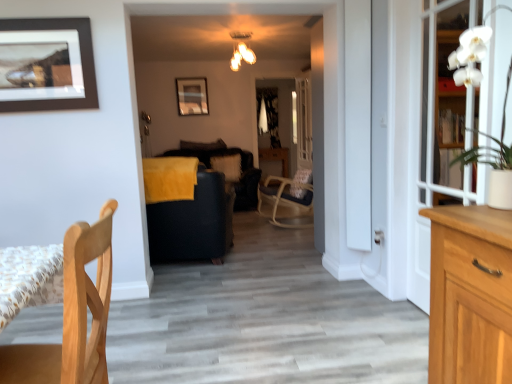
Question: Considering the relative sizes of matte black picture frame at upper center, the second picture frame ordered from the bottom, and clear glass door at center, the 1th glass door viewed from the left, in the image provided, is matte black picture frame at upper center, the second picture frame ordered from the bottom, taller than clear glass door at center, the 1th glass door viewed from the left,?

Choices:
 (A) yes
 (B) no

Answer: (B)

Question: Is matte black picture frame at upper center, arranged as the 2th picture frame when viewed from the front, oriented towards clear glass door at center, positioned as the first glass door in back-to-front order?

Choices:
 (A) yes
 (B) no

Answer: (B)

Question: Is matte black picture frame at upper center, the 1th picture frame positioned from the top, outside of clear glass door at center, positioned as the 2th glass door in front-to-back order?

Choices:
 (A) no
 (B) yes

Answer: (B)

Question: Are matte black picture frame at upper center, arranged as the 2th picture frame when viewed from the front, and clear glass door at center, which is the 2th glass door in right-to-left order, far apart?

Choices:
 (A) no
 (B) yes

Answer: (B)

Question: From the image's perspective, would you say matte black picture frame at upper center, arranged as the 2th picture frame when viewed from the front, is shown under clear glass door at center, which is the 2th glass door in right-to-left order?

Choices:
 (A) yes
 (B) no

Answer: (B)

Question: Does matte black picture frame at upper center, the second picture frame ordered from the bottom, come behind clear glass door at center, which is the 2th glass door in right-to-left order?

Choices:
 (A) yes
 (B) no

Answer: (A)

Question: Is metallic glass chandelier at upper center positioned in front of clear glass door at center, the 1th glass door viewed from the left?

Choices:
 (A) yes
 (B) no

Answer: (A)

Question: Is metallic glass chandelier at upper center wider than clear glass door at center, the 1th glass door viewed from the left?

Choices:
 (A) yes
 (B) no

Answer: (A)

Question: From a real-world perspective, does metallic glass chandelier at upper center sit lower than clear glass door at center, positioned as the 2th glass door in front-to-back order?

Choices:
 (A) no
 (B) yes

Answer: (A)

Question: Is metallic glass chandelier at upper center surrounding clear glass door at center, positioned as the first glass door in back-to-front order?

Choices:
 (A) yes
 (B) no

Answer: (B)

Question: Could you tell me if metallic glass chandelier at upper center is facing clear glass door at center, which is the 2th glass door in right-to-left order?

Choices:
 (A) no
 (B) yes

Answer: (A)

Question: Considering the relative positions of metallic glass chandelier at upper center and clear glass door at center, positioned as the 2th glass door in front-to-back order, in the image provided, is metallic glass chandelier at upper center to the right of clear glass door at center, positioned as the 2th glass door in front-to-back order, from the viewer's perspective?

Choices:
 (A) no
 (B) yes

Answer: (A)

Question: Is velvet black couch at center positioned with its back to brown matte picture frame at upper left, positioned as the first picture frame in front-to-back order?

Choices:
 (A) yes
 (B) no

Answer: (B)